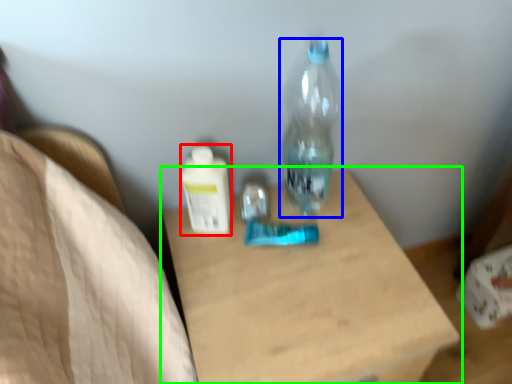
Question: Based on their relative distances, which object is nearer to bottle (highlighted by a red box)? Choose from bottle (highlighted by a blue box) and table (highlighted by a green box).

Choices:
 (A) bottle
 (B) table

Answer: (A)